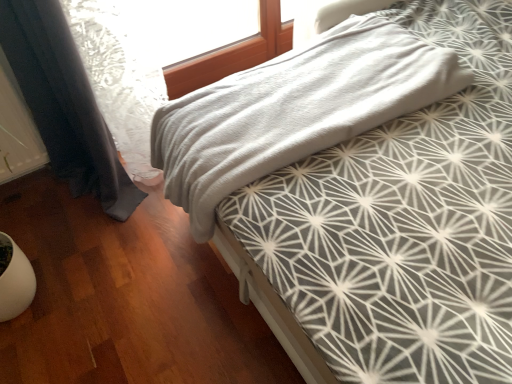
Image resolution: width=512 pixels, height=384 pixels. Describe the element at coordinates (65, 104) in the screenshot. I see `dark blue fabric curtain at left` at that location.

Find the location of a particular element. dark blue fabric curtain at left is located at coordinates (65, 104).

Describe the element at coordinates (365, 192) in the screenshot. The width and height of the screenshot is (512, 384). I see `gray soft fabric bed at center` at that location.

Image resolution: width=512 pixels, height=384 pixels. In order to click on gray soft fabric bed at center in this screenshot , I will do `click(365, 192)`.

What is the approximate height of gray soft fabric bed at center?

The height of gray soft fabric bed at center is 12.75 inches.

Find the location of a particular element. The height and width of the screenshot is (384, 512). dark blue fabric curtain at left is located at coordinates (65, 104).

Considering the relative positions of dark blue fabric curtain at left and gray soft fabric bed at center in the image provided, is dark blue fabric curtain at left to the left or to the right of gray soft fabric bed at center?

In the image, dark blue fabric curtain at left appears on the left side of gray soft fabric bed at center.

Considering the positions of objects dark blue fabric curtain at left and gray soft fabric bed at center in the image provided, who is behind, dark blue fabric curtain at left or gray soft fabric bed at center?

gray soft fabric bed at center is further from the camera.

Considering the points (29, 25) and (418, 212), which point is in front, point (29, 25) or point (418, 212)?

Point (418, 212)

From the image's perspective, is dark blue fabric curtain at left under gray soft fabric bed at center?

Correct, dark blue fabric curtain at left appears lower than gray soft fabric bed at center in the image.

From a real-world perspective, which object stands above the other?

dark blue fabric curtain at left, from a real-world perspective.

Is dark blue fabric curtain at left wider or thinner than gray soft fabric bed at center?

In the image, dark blue fabric curtain at left appears to be more narrow than gray soft fabric bed at center.

Considering the sizes of objects dark blue fabric curtain at left and gray soft fabric bed at center in the image provided, who is taller, dark blue fabric curtain at left or gray soft fabric bed at center?

With more height is dark blue fabric curtain at left.

Considering the sizes of objects dark blue fabric curtain at left and gray soft fabric bed at center in the image provided, who is bigger, dark blue fabric curtain at left or gray soft fabric bed at center?

With larger size is dark blue fabric curtain at left.

Is dark blue fabric curtain at left completely or partially outside of gray soft fabric bed at center?

Absolutely, dark blue fabric curtain at left is external to gray soft fabric bed at center.

Looking at this image, are dark blue fabric curtain at left and gray soft fabric bed at center far apart?

Actually, dark blue fabric curtain at left and gray soft fabric bed at center are a little close together.

Is dark blue fabric curtain at left aimed at gray soft fabric bed at center?

Yes, dark blue fabric curtain at left is aimed at gray soft fabric bed at center.

The height and width of the screenshot is (384, 512). In order to click on bed behind the dark blue fabric curtain at left in this screenshot , I will do click(365, 192).

Considering the positions of objects gray soft fabric bed at center and dark blue fabric curtain at left in the image provided, who is more to the right, gray soft fabric bed at center or dark blue fabric curtain at left?

gray soft fabric bed at center is more to the right.

Is gray soft fabric bed at center in front of or behind dark blue fabric curtain at left in the image?

gray soft fabric bed at center is behind dark blue fabric curtain at left.

Is point (375, 168) more distant than point (57, 60)?

That is False.

From the image's perspective, is gray soft fabric bed at center on dark blue fabric curtain at left?

Correct, gray soft fabric bed at center appears higher than dark blue fabric curtain at left in the image.

From a real-world perspective, is gray soft fabric bed at center above or below dark blue fabric curtain at left?

gray soft fabric bed at center is below dark blue fabric curtain at left.

Looking at their sizes, would you say gray soft fabric bed at center is wider or thinner than dark blue fabric curtain at left?

Considering their sizes, gray soft fabric bed at center looks broader than dark blue fabric curtain at left.

Is gray soft fabric bed at center shorter than dark blue fabric curtain at left?

Yes, gray soft fabric bed at center is shorter than dark blue fabric curtain at left.

Is gray soft fabric bed at center smaller than dark blue fabric curtain at left?

Indeed, gray soft fabric bed at center has a smaller size compared to dark blue fabric curtain at left.

Is gray soft fabric bed at center not within dark blue fabric curtain at left?

That's correct, gray soft fabric bed at center is outside of dark blue fabric curtain at left.

Looking at this image, would you say gray soft fabric bed at center is a long distance from dark blue fabric curtain at left?

No, gray soft fabric bed at center is not far from dark blue fabric curtain at left.

Is gray soft fabric bed at center positioned with its back to dark blue fabric curtain at left?

No.

How many degrees apart are the facing directions of gray soft fabric bed at center and dark blue fabric curtain at left?

The angular difference between gray soft fabric bed at center and dark blue fabric curtain at left is 178 degrees.

How far apart are gray soft fabric bed at center and dark blue fabric curtain at left?

The distance of gray soft fabric bed at center from dark blue fabric curtain at left is 28.88 inches.

Locate an element on the screen. This screenshot has height=384, width=512. curtain above the gray soft fabric bed at center (from a real-world perspective) is located at coordinates (65, 104).

Identify the location of curtain in front of the gray soft fabric bed at center. This screenshot has height=384, width=512. (65, 104).

In the image, there is a gray soft fabric bed at center. Identify the location of curtain below it (from the image's perspective). (65, 104).